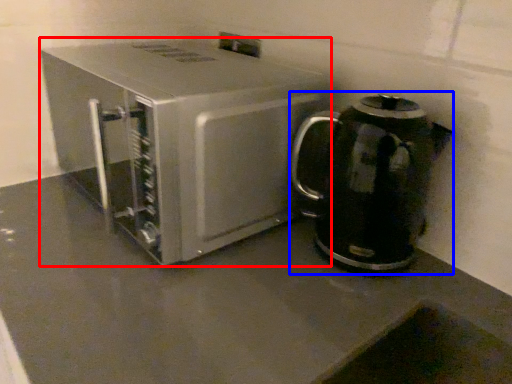
Question: Among these objects, which one is nearest to the camera, kitchen appliance (highlighted by a red box) or kitchen appliance (highlighted by a blue box)?

Choices:
 (A) kitchen appliance
 (B) kitchen appliance

Answer: (A)